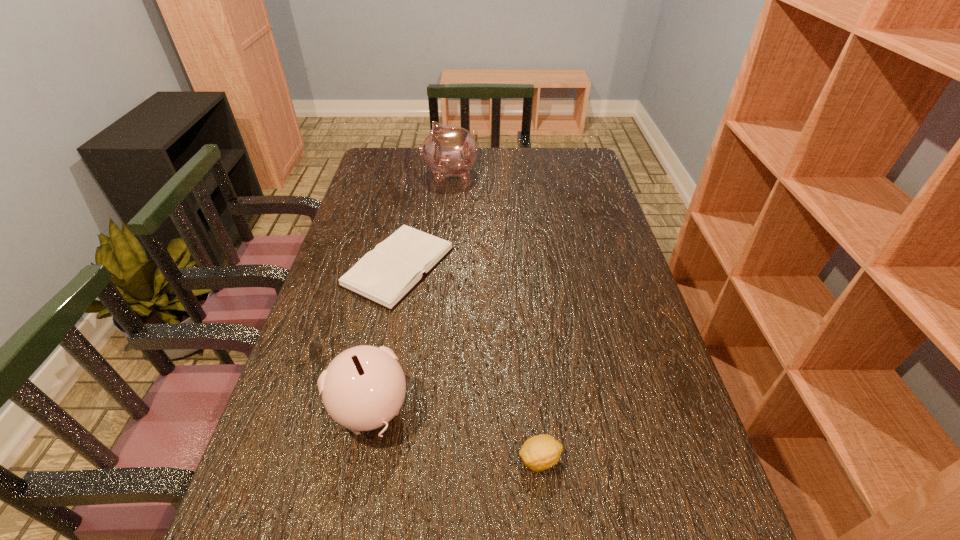
The height and width of the screenshot is (540, 960). I want to click on vacant space at the left edge of the desktop, so click(x=358, y=313).

The image size is (960, 540). What are the coordinates of `free location at the right edge` in the screenshot? It's located at (655, 439).

The height and width of the screenshot is (540, 960). Identify the location of free location at the far left corner of the desktop. (367, 166).

Identify the location of free space at the far right corner. This screenshot has height=540, width=960. (570, 148).

Image resolution: width=960 pixels, height=540 pixels. In order to click on vacant area that lies between the hardback book and the tallest object in this screenshot , I will do `click(424, 220)`.

You are a GUI agent. You are given a task and a screenshot of the screen. Output one action in this format:
    pyautogui.click(x=<x>, y=<y>)
    Task: Click on the empty space that is in between the farther piggy bank and the second shortest object
    The image size is (960, 540).
    Given the screenshot: What is the action you would take?
    pyautogui.click(x=495, y=316)

This screenshot has height=540, width=960. In order to click on free spot between the second tallest object and the third nearest object in this screenshot , I will do `click(385, 338)`.

Locate an element on the screen. Image resolution: width=960 pixels, height=540 pixels. free space between the second shortest object and the nearer piggy bank is located at coordinates (455, 435).

Where is `unoccupied position between the rightmost object and the shortest object`? The width and height of the screenshot is (960, 540). unoccupied position between the rightmost object and the shortest object is located at coordinates (469, 363).

Where is `unoccupied area between the rightmost object and the second farthest object`? This screenshot has width=960, height=540. unoccupied area between the rightmost object and the second farthest object is located at coordinates (469, 363).